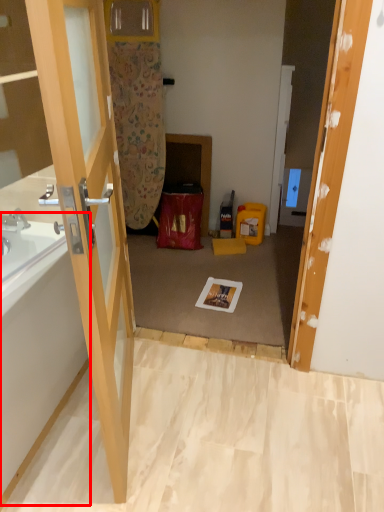
Question: From the image's perspective, where is bath (annotated by the red box) located relative to door?

Choices:
 (A) above
 (B) below

Answer: (B)